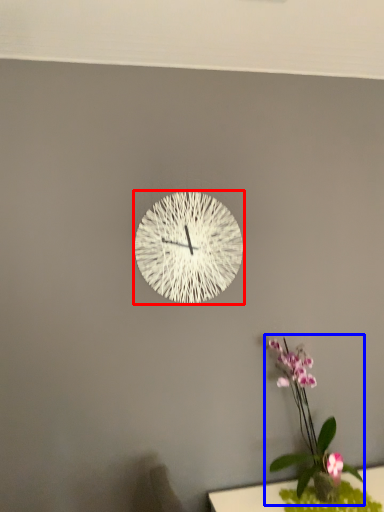
Question: Which point is closer to the camera, wall clock (highlighted by a red box) or floral arrangement (highlighted by a blue box)?

Choices:
 (A) wall clock
 (B) floral arrangement

Answer: (B)